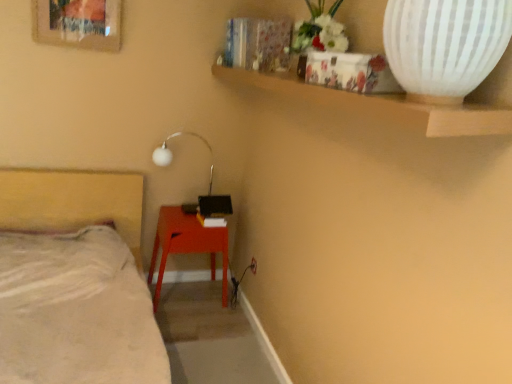
What are the coordinates of `white ribbed vase at upper right` in the screenshot? It's located at (445, 45).

At what (x,y) coordinates should I click in order to perform the action: click on wooden picture frame at upper left. Please return your answer as a coordinate pair (x, y). This screenshot has width=512, height=384. Looking at the image, I should click on 78,23.

The image size is (512, 384). I want to click on matte red table at lower center, so click(x=187, y=245).

Where is `white soft bed at lower left`? white soft bed at lower left is located at coordinates (75, 282).

Image resolution: width=512 pixels, height=384 pixels. Find the location of `white ribbed vase at upper right`. white ribbed vase at upper right is located at coordinates pyautogui.click(x=445, y=45).

Can you confirm if white ribbed vase at upper right is wider than white soft bed at lower left?

Incorrect, the width of white ribbed vase at upper right does not surpass that of white soft bed at lower left.

Relative to white soft bed at lower left, is white ribbed vase at upper right in front or behind?

Visually, white ribbed vase at upper right is located behind white soft bed at lower left.

From the image's perspective, between white ribbed vase at upper right and white soft bed at lower left, who is located below?

white soft bed at lower left is shown below in the image.

Is white ribbed vase at upper right at the left side of white soft bed at lower left?

No, white ribbed vase at upper right is not to the left of white soft bed at lower left.

Considering the relative positions of white glossy lamp at upper center and wooden picture frame at upper left in the image provided, is white glossy lamp at upper center to the left or to the right of wooden picture frame at upper left?

Based on their positions, white glossy lamp at upper center is located to the right of wooden picture frame at upper left.

Is the surface of white glossy lamp at upper center in direct contact with wooden picture frame at upper left?

No, white glossy lamp at upper center is not with wooden picture frame at upper left.

Looking at this image, is white glossy lamp at upper center facing towards wooden picture frame at upper left?

No, white glossy lamp at upper center is not turned towards wooden picture frame at upper left.

Between point (157, 154) and point (46, 11), which one is positioned in front?

Positioned in front is point (46, 11).

Choose the correct answer: Is wooden picture frame at upper left inside white soft bed at lower left or outside it?

wooden picture frame at upper left cannot be found inside white soft bed at lower left.

Based on their sizes in the image, would you say wooden picture frame at upper left is bigger or smaller than white soft bed at lower left?

Considering their sizes, wooden picture frame at upper left takes up less space than white soft bed at lower left.

Does wooden picture frame at upper left lie behind white soft bed at lower left?

Yes, the depth of wooden picture frame at upper left is greater than that of white soft bed at lower left.

Based on the photo, considering the sizes of objects wooden picture frame at upper left and white soft bed at lower left in the image provided, who is taller, wooden picture frame at upper left or white soft bed at lower left?

With more height is white soft bed at lower left.

Does point (118, 27) lie in front of point (178, 226)?

Yes, it is.

How different are the orientations of wooden picture frame at upper left and matte red table at lower center in degrees?

The facing directions of wooden picture frame at upper left and matte red table at lower center are 0.502 degrees apart.

Based on the photo, is wooden picture frame at upper left bigger or smaller than matte red table at lower center?

wooden picture frame at upper left is smaller than matte red table at lower center.

Is matte red table at lower center surrounded by wooden picture frame at upper left?

Definitely not — matte red table at lower center is not inside wooden picture frame at upper left.

Does point (106, 6) appear closer or farther from the camera than point (170, 161)?

Clearly, point (106, 6) is closer to the camera than point (170, 161).

From the image's perspective, is wooden picture frame at upper left above white glossy lamp at upper center?

Yes, from the image's perspective, wooden picture frame at upper left is over white glossy lamp at upper center.

Between wooden picture frame at upper left and white glossy lamp at upper center, which one has larger width?

white glossy lamp at upper center is wider.

Is wooden picture frame at upper left outside of white glossy lamp at upper center?

Yes, wooden picture frame at upper left is outside of white glossy lamp at upper center.

How different are the orientations of white glossy lamp at upper center and white ribbed vase at upper right in degrees?

The angle between the facing direction of white glossy lamp at upper center and the facing direction of white ribbed vase at upper right is 90.9 degrees.

Considering the points (204, 142) and (387, 36), which point is behind, point (204, 142) or point (387, 36)?

Positioned behind is point (204, 142).

From the image's perspective, would you say white glossy lamp at upper center is positioned over white ribbed vase at upper right?

No, from the image's perspective, white glossy lamp at upper center is not over white ribbed vase at upper right.

Is white glossy lamp at upper center wider than white ribbed vase at upper right?

No.

From a real-world perspective, is white glossy lamp at upper center over matte red table at lower center?

Yes, from a real-world perspective, white glossy lamp at upper center is over matte red table at lower center

From the image's perspective, relative to matte red table at lower center, is white glossy lamp at upper center above or below?

white glossy lamp at upper center is above matte red table at lower center.

Can you confirm if white glossy lamp at upper center is bigger than matte red table at lower center?

No, white glossy lamp at upper center is not bigger than matte red table at lower center.

In order to click on bed on the left of white ribbed vase at upper right in this screenshot , I will do `click(75, 282)`.

At what (x,y) coordinates should I click in order to perform the action: click on picture frame located above the white glossy lamp at upper center (from the image's perspective). Please return your answer as a coordinate pair (x, y). Looking at the image, I should click on (78, 23).

From the image, which object appears to be farther from matte red table at lower center, white ribbed vase at upper right or white glossy lamp at upper center?

Based on the image, white ribbed vase at upper right appears to be further to matte red table at lower center.

Considering their positions, is white soft bed at lower left positioned closer to white ribbed vase at upper right than matte red table at lower center?

white soft bed at lower left is positioned closer to the anchor white ribbed vase at upper right.

Based on their spatial positions, is white glossy lamp at upper center or white soft bed at lower left closer to matte red table at lower center?

white glossy lamp at upper center.

Estimate the real-world distances between objects in this image. Which object is further from white soft bed at lower left, wooden picture frame at upper left or white glossy lamp at upper center?

wooden picture frame at upper left is further to white soft bed at lower left.

Looking at this image, estimate the real-world distances between objects in this image. Which object is further from matte red table at lower center, wooden picture frame at upper left or white glossy lamp at upper center?

wooden picture frame at upper left is further to matte red table at lower center.

Looking at the image, which one is located further to white soft bed at lower left, matte red table at lower center or white glossy lamp at upper center?

white glossy lamp at upper center.

From the image, which object appears to be nearer to white glossy lamp at upper center, white soft bed at lower left or matte red table at lower center?

Among the two, matte red table at lower center is located nearer to white glossy lamp at upper center.

Looking at the image, which one is located closer to white ribbed vase at upper right, wooden picture frame at upper left or matte red table at lower center?

matte red table at lower center lies closer to white ribbed vase at upper right than the other object.

The height and width of the screenshot is (384, 512). I want to click on vase between white soft bed at lower left and wooden picture frame at upper left in the front-back direction, so click(x=445, y=45).

This screenshot has width=512, height=384. Find the location of `picture frame positioned between white soft bed at lower left and white glossy lamp at upper center from near to far`. picture frame positioned between white soft bed at lower left and white glossy lamp at upper center from near to far is located at coordinates (78, 23).

Identify the location of picture frame positioned between white soft bed at lower left and matte red table at lower center from near to far. (78, 23).

Where is `picture frame between white ribbed vase at upper right and matte red table at lower center in the front-back direction`? This screenshot has width=512, height=384. picture frame between white ribbed vase at upper right and matte red table at lower center in the front-back direction is located at coordinates (78, 23).